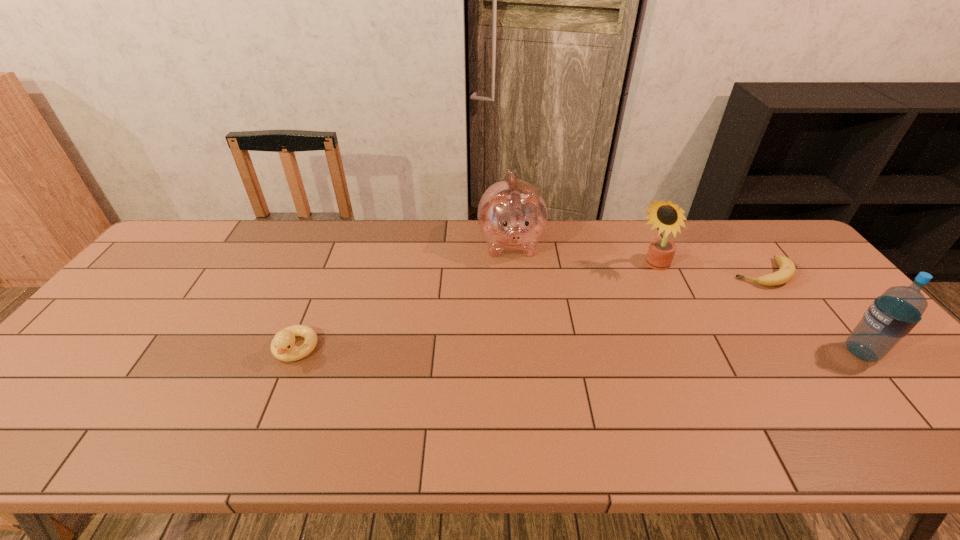
Identify the location of duckling. (282, 346).

Identify the location of the leftmost object. (282, 346).

I want to click on water bottle, so click(891, 316).

In order to click on sunflower in this screenshot , I will do coord(667,216).

This screenshot has width=960, height=540. In order to click on banana in this screenshot , I will do `click(786, 272)`.

You are a GUI agent. You are given a task and a screenshot of the screen. Output one action in this format:
    pyautogui.click(x=<x>, y=<y>)
    Task: Click on the piggy bank
    This screenshot has height=540, width=960.
    Given the screenshot: What is the action you would take?
    pyautogui.click(x=512, y=215)

At what (x,y) coordinates should I click in order to perform the action: click on vacant space located at the beak of the fourth tallest object. Please return your answer as a coordinate pair (x, y). Looking at the image, I should click on (276, 398).

Locate an element on the screen. The image size is (960, 540). vacant region located on the left of the water bottle is located at coordinates (824, 353).

Where is `vacant region located 0.260m on the face of the sunflower`? Image resolution: width=960 pixels, height=540 pixels. vacant region located 0.260m on the face of the sunflower is located at coordinates (592, 325).

This screenshot has height=540, width=960. I want to click on vacant space located 0.210m on the face of the sunflower, so click(x=603, y=315).